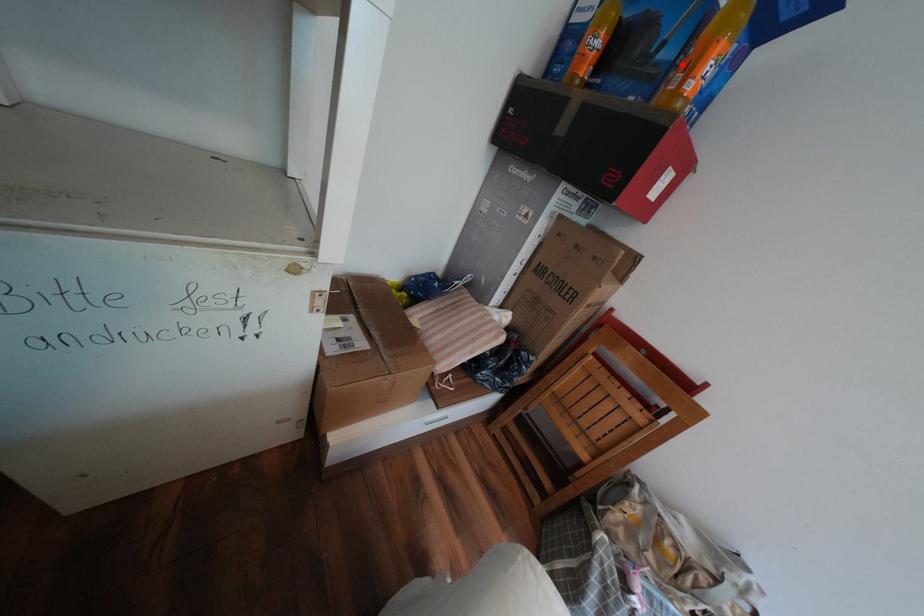
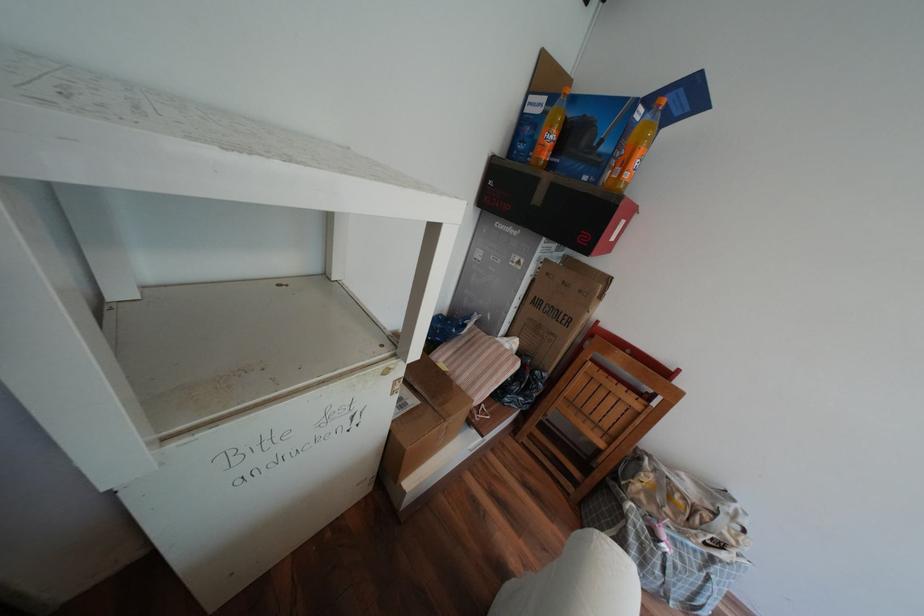
Where in the second image is the point corresponding to the highlighted location from the first image?

(621, 156)